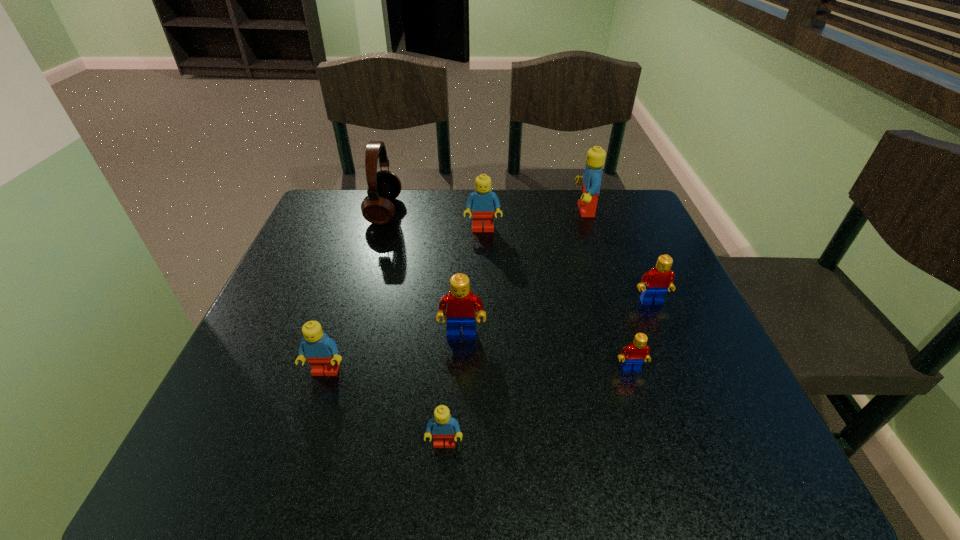
Identify the location of vacant region at the far edge of the desktop. This screenshot has height=540, width=960. (552, 201).

The width and height of the screenshot is (960, 540). In the image, there is a desktop. Find the location of `vacant space at the left edge`. vacant space at the left edge is located at coordinates (256, 411).

Locate an element on the screen. This screenshot has width=960, height=540. free space at the right edge is located at coordinates coord(707,381).

Locate an element on the screen. This screenshot has width=960, height=540. free space at the far left corner of the desktop is located at coordinates point(363,235).

Where is `vacant space at the far right corner of the desktop`? This screenshot has width=960, height=540. vacant space at the far right corner of the desktop is located at coordinates (625, 230).

The width and height of the screenshot is (960, 540). Find the location of `empty location between the third nearest blue Lego and the second farthest red Lego`. empty location between the third nearest blue Lego and the second farthest red Lego is located at coordinates (472, 282).

The height and width of the screenshot is (540, 960). Identify the location of free space between the nearest blue Lego and the smallest red Lego. (538, 406).

Locate an element on the screen. The image size is (960, 540). free area in between the farthest Lego and the nearest Lego is located at coordinates (515, 327).

Where is `unoccupied position between the black headset and the fifth farthest object`? The image size is (960, 540). unoccupied position between the black headset and the fifth farthest object is located at coordinates (423, 273).

At what (x,y) coordinates should I click in order to perform the action: click on free spot between the nearest red Lego and the farthest blue Lego. Please return your answer as a coordinate pair (x, y). Looking at the image, I should click on (608, 289).